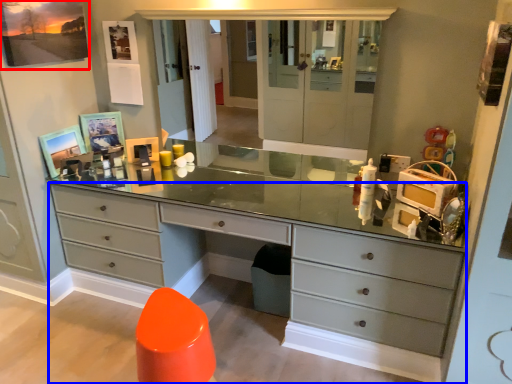
Question: Which object appears farthest to the camera in this image, picture frame (highlighted by a red box) or chest of drawers (highlighted by a blue box)?

Choices:
 (A) picture frame
 (B) chest of drawers

Answer: (A)